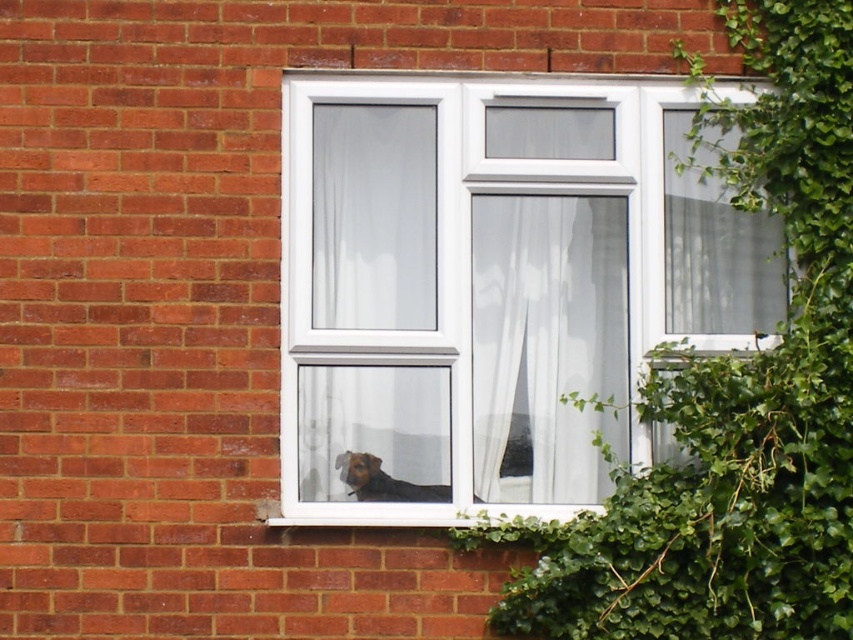
You are an interior designer assessing the wall space. You need to know which object takes up more area on the wall between the white plastic window at center and the green leafy ivy at right. Which one is larger?

The green leafy ivy at right occupies more space than the white plastic window at center, so the ivy is larger.

You are standing in front of a brick wall and want to place a small potted plant between the white plastic window at center and the green leafy ivy at right. According to the scene, which object should the potted plant be closer to?

The white plastic window at center is positioned on the left side of green leafy ivy at right, so the potted plant should be placed closer to the white plastic window at center to be between them.

You are standing in front of the brick wall and want to place a decorative pot exactly at the location of the green leafy ivy at right. What coordinates should you aim for?

The green leafy ivy at right is located at coordinates point [734,394], so you should aim for those coordinates to place the decorative pot.